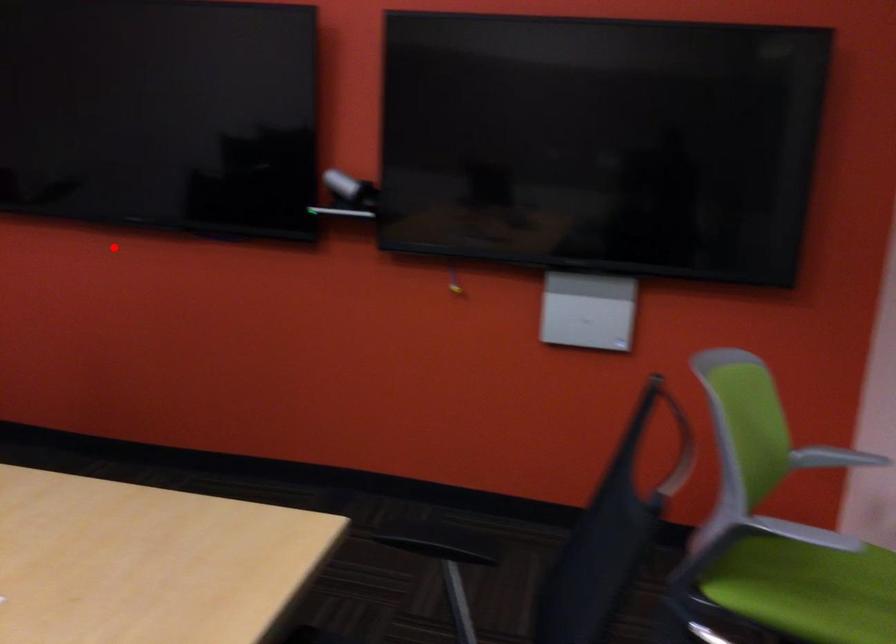
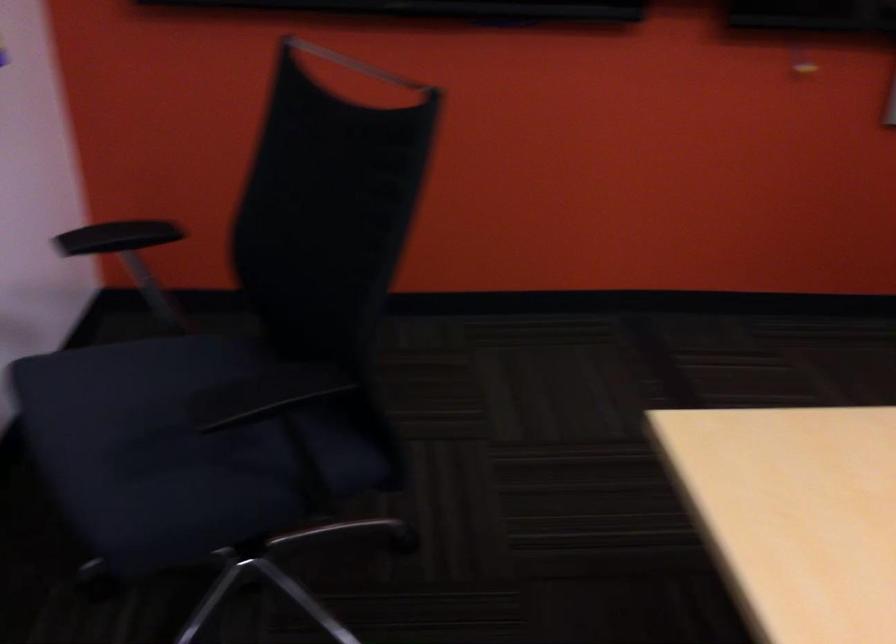
Question: I am providing you with two images of the same scene from different viewpoints. Given a red point in image1, look at the same physical point in image2. Is it:

Choices:
 (A) Closer to the viewpoint
 (B) Farther from the viewpoint

Answer: (A)